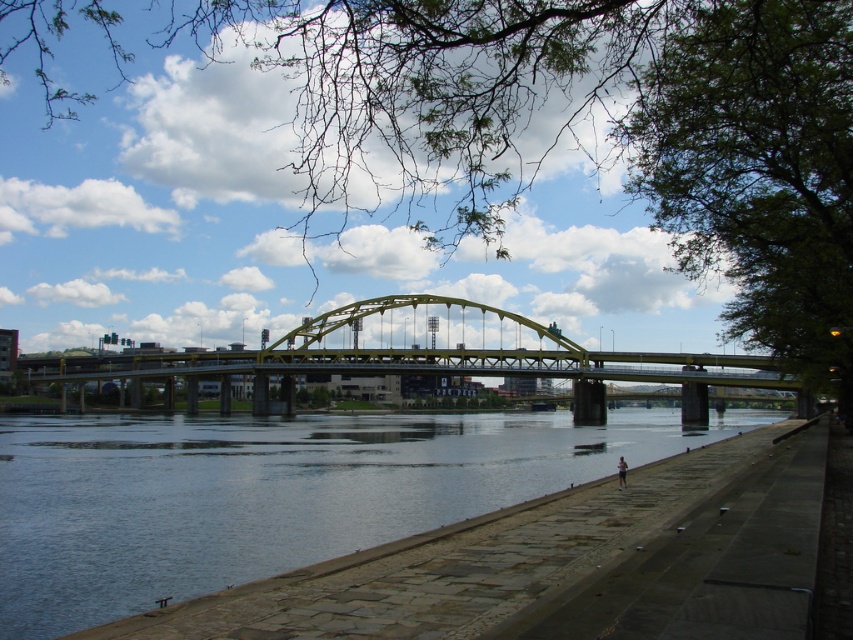
You are standing at the origin point of the coordinate system in this riverside scene. You want to locate the clear water at lower left. According to the coordinate system, where is it positioned?

The clear water at lower left is positioned at coordinates point [267,493].

You are standing at the point marked as point (267, 493) in the image. What is the nearest object to you in the scene?

The nearest object to you at point (267, 493) is clear water at lower left, as the coordinates directly correspond to this location.